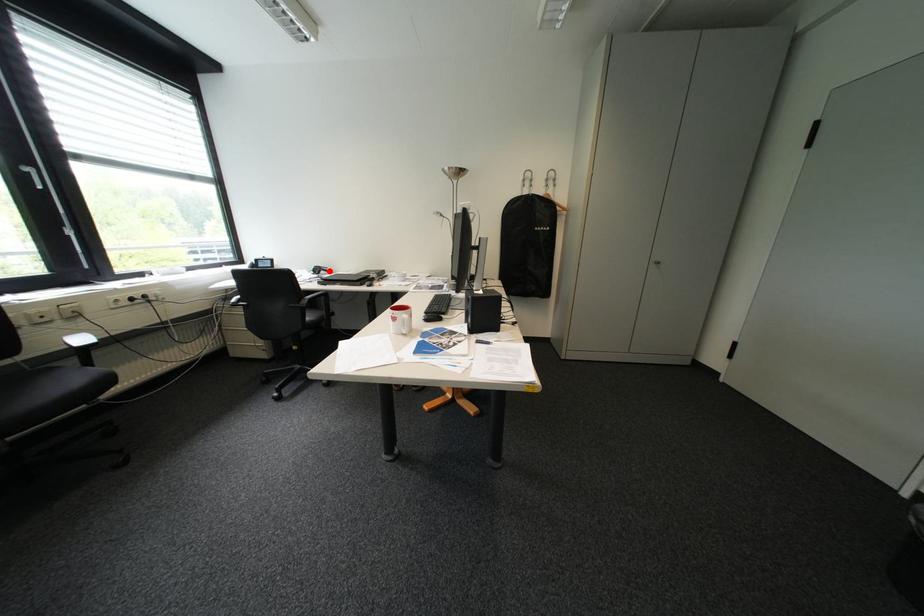
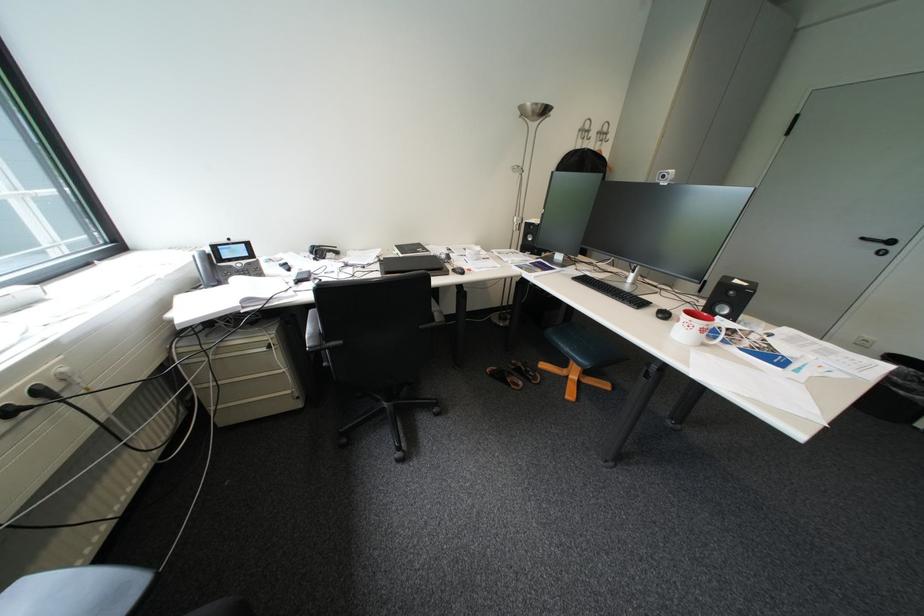
Find the pixel in the second image that matches the highlighted location in the first image.

(331, 253)